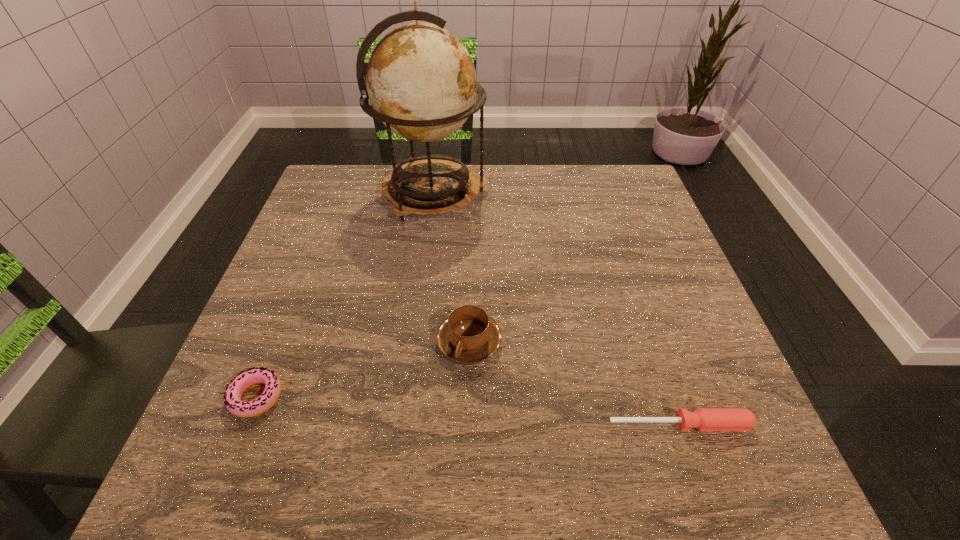
Locate an element on the screen. The image size is (960, 540). object that is at the far edge is located at coordinates (421, 81).

This screenshot has height=540, width=960. Find the location of `object that is at the near edge`. object that is at the near edge is located at coordinates (704, 419).

Find the location of a particular element. object located at the left edge is located at coordinates (232, 397).

What are the coordinates of `object positioned at the right edge` in the screenshot? It's located at (704, 419).

Find the location of a particular element. The image size is (960, 540). object located in the near right corner section of the desktop is located at coordinates (704, 419).

In the image, there is a desktop. Where is `vacant space at the far edge`? vacant space at the far edge is located at coordinates (527, 174).

In the image, there is a desktop. Identify the location of free region at the near edge. (489, 442).

At what (x,y) coordinates should I click in order to perform the action: click on vacant space at the left edge of the desktop. Please return your answer as a coordinate pair (x, y). Looking at the image, I should click on (320, 329).

In the image, there is a desktop. What are the coordinates of `free region at the right edge` in the screenshot? It's located at (634, 314).

Locate an element on the screen. The width and height of the screenshot is (960, 540). vacant region at the far right corner of the desktop is located at coordinates (597, 170).